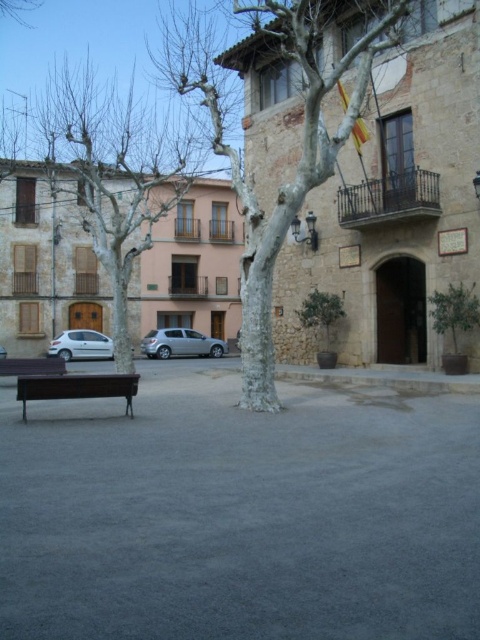
Can you confirm if silver metallic car at lower left is wider than silver metallic car at left?

Correct, the width of silver metallic car at lower left exceeds that of silver metallic car at left.

Measure the distance from silver metallic car at lower left to silver metallic car at left.

They are 11.95 feet apart.

Looking at this image, who is more forward, (83,355) or (4,353)?

Point (4,353) is in front.

Locate an element on the screen. This screenshot has height=640, width=480. silver metallic car at lower left is located at coordinates (81, 346).

Between bare wood tree at left and dark brown wooden bench at lower left, which one appears on the left side from the viewer's perspective?

bare wood tree at left

Does point (153, 136) come behind point (40, 362)?

Yes.

The height and width of the screenshot is (640, 480). What are the coordinates of `bare wood tree at left` in the screenshot? It's located at (115, 177).

Locate an element on the screen. silver metallic car at lower left is located at coordinates (81, 346).

Can you confirm if silver metallic car at lower left is positioned to the left of dark brown wooden bench at lower left?

Correct, you'll find silver metallic car at lower left to the left of dark brown wooden bench at lower left.

The height and width of the screenshot is (640, 480). In order to click on silver metallic car at lower left in this screenshot , I will do [x=81, y=346].